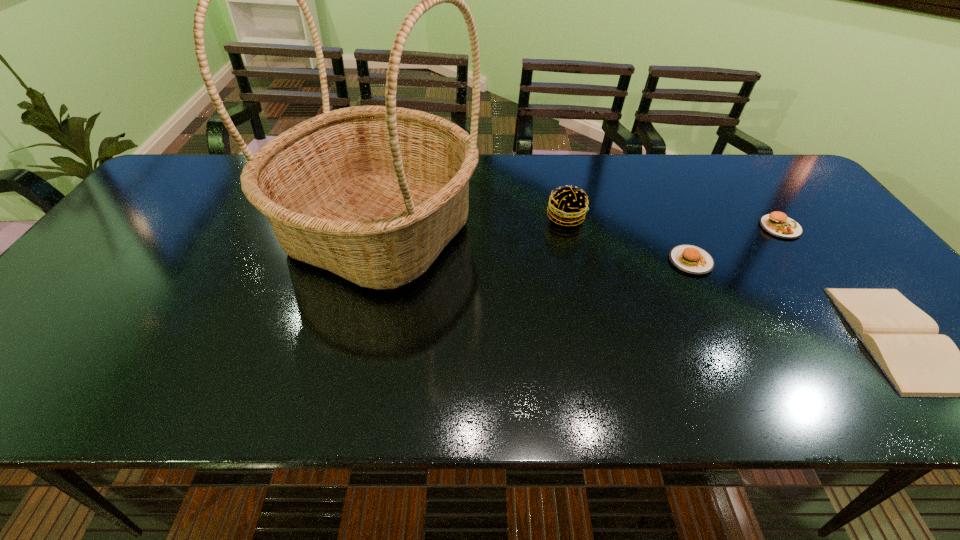
The width and height of the screenshot is (960, 540). What are the coordinates of `unoccupied area between the tallest food and the tallest object` in the screenshot? It's located at (472, 224).

Where is `free space that is in between the second food from left to right and the rightmost food`? Image resolution: width=960 pixels, height=540 pixels. free space that is in between the second food from left to right and the rightmost food is located at coordinates (735, 244).

At what (x,y) coordinates should I click in order to perform the action: click on vacant area that lies between the basket and the second food from left to right. Please return your answer as a coordinate pair (x, y). Image resolution: width=960 pixels, height=540 pixels. Looking at the image, I should click on (535, 246).

At what (x,y) coordinates should I click in order to perform the action: click on vacant space that is in between the tallest object and the second food from left to right. Please return your answer as a coordinate pair (x, y). Looking at the image, I should click on (535, 246).

I want to click on object that stands as the fourth closest to the rightmost food, so click(x=373, y=194).

Locate an element on the screen. object that can be found as the fourth closest to the nearest food is located at coordinates (373, 194).

Point out which food is positioned as the nearest to the nearest food. Please provide its 2D coordinates. Your answer should be formatted as a tuple, i.e. [(x, y)], where the tuple contains the x and y coordinates of a point satisfying the conditions above.

[(778, 224)]

Choose which food is the nearest neighbor to the nearest food. Please provide its 2D coordinates. Your answer should be formatted as a tuple, i.e. [(x, y)], where the tuple contains the x and y coordinates of a point satisfying the conditions above.

[(778, 224)]

Locate an element on the screen. The height and width of the screenshot is (540, 960). free region that satisfies the following two spatial constraints: 1. on the front side of the basket; 2. on the right side of the nearest food is located at coordinates (372, 261).

The width and height of the screenshot is (960, 540). Identify the location of vacant space that satisfies the following two spatial constraints: 1. on the front side of the leftmost food; 2. on the left side of the rightmost food. (568, 227).